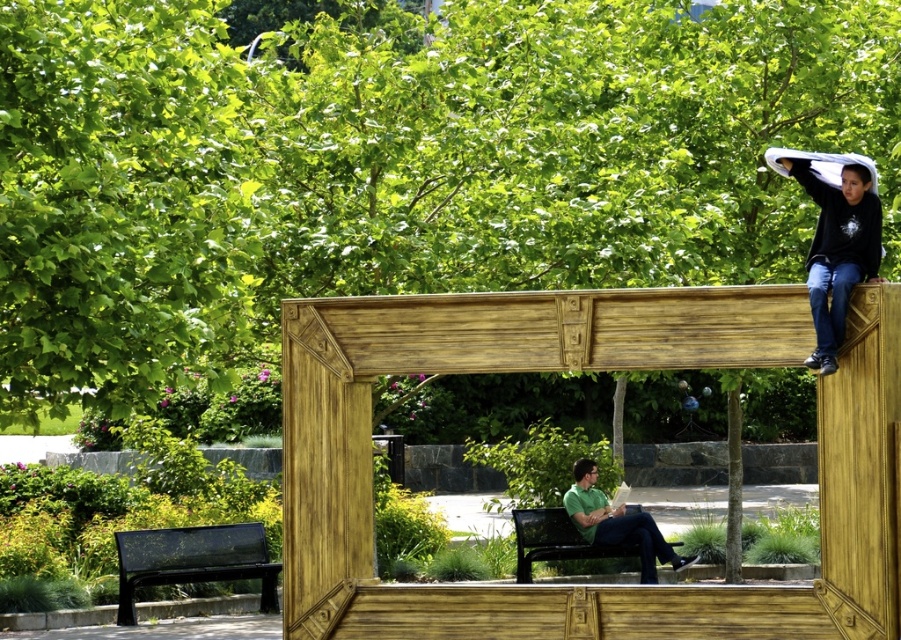
Question: Which object is closer to the camera taking this photo?

Choices:
 (A) green leafy tree at upper center
 (B) black metal bench at lower center
 (C) green matte shirt at lower center

Answer: (A)

Question: Is green leafy tree at upper center above black metal bench at lower left?

Choices:
 (A) no
 (B) yes

Answer: (B)

Question: Which object is closer to the camera taking this photo?

Choices:
 (A) black matte hoodie at upper right
 (B) green leafy tree at upper center

Answer: (A)

Question: Is black metal bench at lower left wider than black metal bench at lower center?

Choices:
 (A) yes
 (B) no

Answer: (B)

Question: Does green leafy tree at upper left have a greater width compared to green matte shirt at lower center?

Choices:
 (A) no
 (B) yes

Answer: (A)

Question: Which point appears farthest from the camera in this image?

Choices:
 (A) (276, 596)
 (B) (678, 605)

Answer: (A)